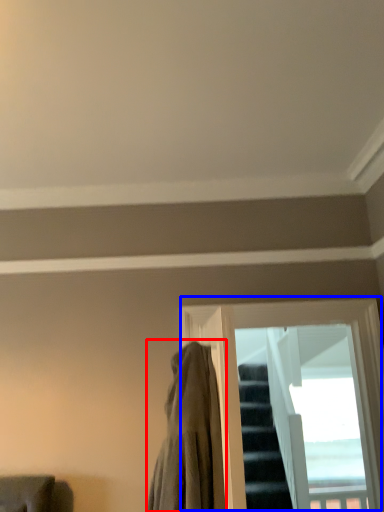
Question: Among these objects, which one is farthest to the camera, cloak (highlighted by a red box) or window (highlighted by a blue box)?

Choices:
 (A) cloak
 (B) window

Answer: (B)